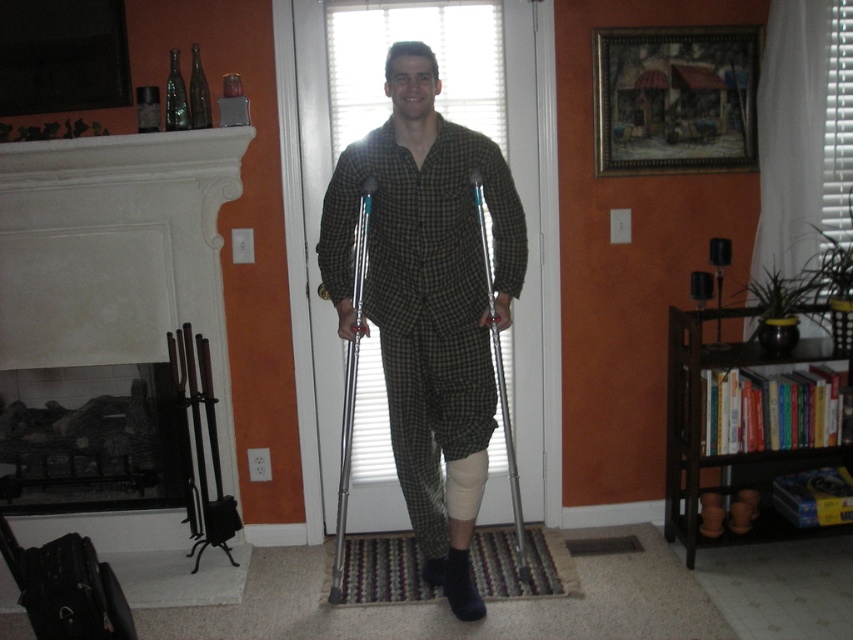
Is the position of metallic silver crutch at center less distant than that of silver metallic crutch at center?

No, metallic silver crutch at center is further to the viewer.

Who is taller, metallic silver crutch at center or silver metallic crutch at center?

metallic silver crutch at center is taller.

Describe the element at coordinates (351, 381) in the screenshot. The width and height of the screenshot is (853, 640). I see `metallic silver crutch at center` at that location.

Identify the location of metallic silver crutch at center. The image size is (853, 640). (351, 381).

Can you confirm if matte green pajamas at center is positioned to the left of metallic silver crutch at center?

In fact, matte green pajamas at center is to the right of metallic silver crutch at center.

Which is below, matte green pajamas at center or metallic silver crutch at center?

metallic silver crutch at center

This screenshot has width=853, height=640. What are the coordinates of `matte green pajamas at center` in the screenshot? It's located at (428, 301).

This screenshot has width=853, height=640. Find the location of `matte green pajamas at center`. matte green pajamas at center is located at coordinates (428, 301).

Who is taller, matte green pajamas at center or silver metallic crutch at center?

With more height is matte green pajamas at center.

Does matte green pajamas at center appear under silver metallic crutch at center?

Actually, matte green pajamas at center is above silver metallic crutch at center.

Does point (436, 317) come behind point (509, 426)?

Yes.

The image size is (853, 640). Identify the location of matte green pajamas at center. (428, 301).